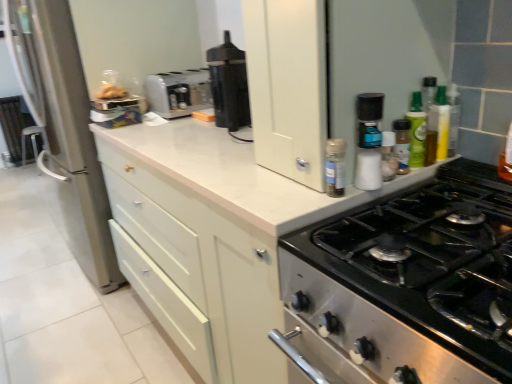
Locate an element on the screen. The height and width of the screenshot is (384, 512). blank area to the left of white plastic spice rack at upper right is located at coordinates (227, 165).